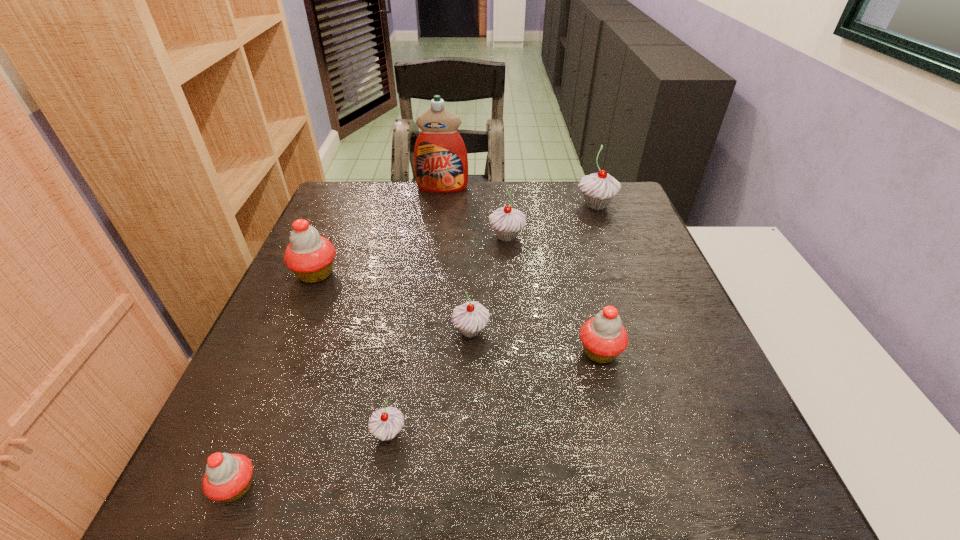
Locate an element on the screen. The image size is (960, 540). free space at the far edge of the desktop is located at coordinates (570, 210).

The width and height of the screenshot is (960, 540). I want to click on blank space at the near edge of the desktop, so click(x=594, y=490).

Find the location of `vacant space at the left edge of the desktop`. vacant space at the left edge of the desktop is located at coordinates (292, 389).

You are a GUI agent. You are given a task and a screenshot of the screen. Output one action in this format:
    pyautogui.click(x=<x>, y=<y>)
    Task: Click on the vacant space at the right edge of the desktop
    
    Given the screenshot: What is the action you would take?
    pyautogui.click(x=636, y=268)

The height and width of the screenshot is (540, 960). I want to click on vacant space at the far left corner of the desktop, so click(336, 194).

Find the location of a particular element. Image resolution: width=960 pixels, height=540 pixels. free point between the second biggest red cupcake and the farthest object is located at coordinates (521, 270).

The image size is (960, 540). In order to click on vacant point located between the rightmost red cupcake and the second nearest cupcake in this screenshot , I will do `click(494, 393)`.

At what (x,y) coordinates should I click in order to perform the action: click on free space between the nearest gray cupcake and the farthest cupcake. Please return your answer as a coordinate pair (x, y). Looking at the image, I should click on [x=492, y=319].

Find the location of `vacant space that is in between the biggest red cupcake and the third farthest object`. vacant space that is in between the biggest red cupcake and the third farthest object is located at coordinates (411, 255).

Identify the location of free space between the nearest red cupcake and the second farthest object. (416, 346).